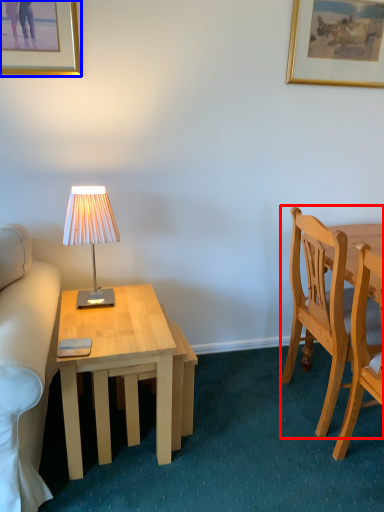
Question: Which object appears farthest to the camera in this image, chair (highlighted by a red box) or picture frame (highlighted by a blue box)?

Choices:
 (A) chair
 (B) picture frame

Answer: (B)